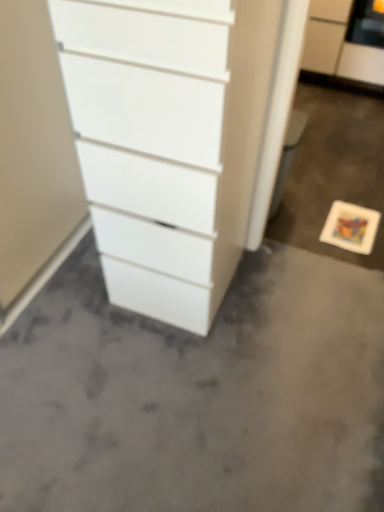
What do you see at coordinates (338, 45) in the screenshot? The image size is (384, 512). I see `white matte filing cabinet at upper right` at bounding box center [338, 45].

Image resolution: width=384 pixels, height=512 pixels. I want to click on white glossy chest of drawers at center, so click(150, 145).

The image size is (384, 512). I want to click on white matte filing cabinet at upper right, so click(338, 45).

Which point is more forward, (5, 365) or (369, 78)?

Positioned in front is point (5, 365).

Locate an element on the screen. This screenshot has height=512, width=384. filing cabinet above the gray matte concrete at center (from a real-world perspective) is located at coordinates (338, 45).

Can you confirm if gray matte concrete at center is positioned to the left of white matte filing cabinet at upper right?

Yes.

Is gray matte concrete at center smaller than white matte filing cabinet at upper right?

Correct, gray matte concrete at center occupies less space than white matte filing cabinet at upper right.

Looking at this image, how many degrees apart are the facing directions of white matte filing cabinet at upper right and white glossy chest of drawers at center?

The angular difference between white matte filing cabinet at upper right and white glossy chest of drawers at center is 0.526 degrees.

Are white matte filing cabinet at upper right and white glossy chest of drawers at center located far from each other?

Yes, white matte filing cabinet at upper right and white glossy chest of drawers at center are located far from each other.

Who is taller, white matte filing cabinet at upper right or white glossy chest of drawers at center?

white glossy chest of drawers at center is taller.

Between white matte filing cabinet at upper right and white glossy chest of drawers at center, which one has larger size?

With larger size is white glossy chest of drawers at center.

Which is behind, point (98, 59) or point (371, 46)?

The point (371, 46) is behind.

I want to click on filing cabinet that is on the right side of white glossy chest of drawers at center, so click(x=338, y=45).

In the image, is white glossy chest of drawers at center positioned in front of or behind white matte filing cabinet at upper right?

In the image, white glossy chest of drawers at center appears in front of white matte filing cabinet at upper right.

Is white glossy chest of drawers at center bigger than white matte filing cabinet at upper right?

Indeed, white glossy chest of drawers at center has a larger size compared to white matte filing cabinet at upper right.

Considering the relative sizes of white glossy chest of drawers at center and gray matte concrete at center in the image provided, is white glossy chest of drawers at center wider than gray matte concrete at center?

In fact, white glossy chest of drawers at center might be narrower than gray matte concrete at center.

From a real-world perspective, between white glossy chest of drawers at center and gray matte concrete at center, who is vertically higher?

From a 3D spatial view, white glossy chest of drawers at center is above.

At what (x,y) coordinates should I click in order to perform the action: click on the chest of drawers that is in front of the gray matte concrete at center. Please return your answer as a coordinate pair (x, y). The height and width of the screenshot is (512, 384). Looking at the image, I should click on (150, 145).

From the image's perspective, which one is positioned higher, white glossy chest of drawers at center or gray matte concrete at center?

white glossy chest of drawers at center.

Is the position of white matte filing cabinet at upper right more distant than that of gray matte concrete at center?

Yes.

From a real-world perspective, between white matte filing cabinet at upper right and gray matte concrete at center, who is vertically lower?

gray matte concrete at center.

Which of these two, white matte filing cabinet at upper right or gray matte concrete at center, is smaller?

With smaller size is gray matte concrete at center.

From the image's perspective, who appears lower, white matte filing cabinet at upper right or gray matte concrete at center?

gray matte concrete at center appears lower in the image.

Is gray matte concrete at center at the right side of white glossy chest of drawers at center?

Yes.

Is gray matte concrete at center next to white glossy chest of drawers at center?

No, gray matte concrete at center is not touching white glossy chest of drawers at center.

This screenshot has height=512, width=384. What are the coordinates of `chest of drawers on the left of gray matte concrete at center` in the screenshot? It's located at (150, 145).

What's the angular difference between gray matte concrete at center and white glossy chest of drawers at center's facing directions?

The angular difference between gray matte concrete at center and white glossy chest of drawers at center is 180 degrees.

In the image, there is a white matte filing cabinet at upper right. What are the coordinates of `concrete below it (from a real-world perspective)` in the screenshot? It's located at tap(198, 394).

Locate an element on the screen. filing cabinet that appears above the white glossy chest of drawers at center (from the image's perspective) is located at coordinates (338, 45).

Considering their positions, is gray matte concrete at center positioned closer to white glossy chest of drawers at center than white matte filing cabinet at upper right?

gray matte concrete at center is positioned closer to the anchor white glossy chest of drawers at center.

Considering their positions, is white matte filing cabinet at upper right positioned closer to white glossy chest of drawers at center than gray matte concrete at center?

The object closer to white glossy chest of drawers at center is gray matte concrete at center.

When comparing their distances from white matte filing cabinet at upper right, does gray matte concrete at center or white glossy chest of drawers at center seem further?

white glossy chest of drawers at center is further to white matte filing cabinet at upper right.

From the picture: Considering their positions, is white glossy chest of drawers at center positioned closer to white matte filing cabinet at upper right than gray matte concrete at center?

Among the two, gray matte concrete at center is located nearer to white matte filing cabinet at upper right.

When comparing their distances from gray matte concrete at center, does white glossy chest of drawers at center or white matte filing cabinet at upper right seem closer?

white glossy chest of drawers at center is closer to gray matte concrete at center.

From the image, which object appears to be nearer to gray matte concrete at center, white matte filing cabinet at upper right or white glossy chest of drawers at center?

Based on the image, white glossy chest of drawers at center appears to be nearer to gray matte concrete at center.

The height and width of the screenshot is (512, 384). I want to click on chest of drawers between white matte filing cabinet at upper right and gray matte concrete at center in the up-down direction, so click(150, 145).